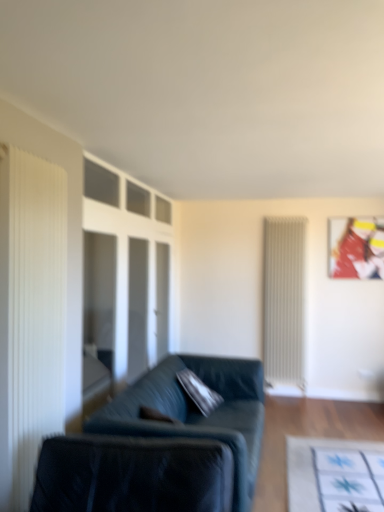
Question: From their relative heights in the image, would you say white pleated curtain at left is taller or shorter than transparent glass door at center?

Choices:
 (A) tall
 (B) short

Answer: (A)

Question: Considering the positions of point (18, 226) and point (147, 278), is point (18, 226) closer or farther from the camera than point (147, 278)?

Choices:
 (A) farther
 (B) closer

Answer: (B)

Question: Estimate the real-world distances between objects in this image. Which object is closer to the white pleated curtain at left?

Choices:
 (A) transparent glass door at center
 (B) white ribbed radiator at right
 (C) velvet dark green pillow at center
 (D) velvet black swivel chair at lower left
 (E) velvet dark green couch at center

Answer: (D)

Question: Which object is the closest to the transparent glass door at center?

Choices:
 (A) velvet dark green pillow at center
 (B) metallic glossy picture frame at upper right
 (C) white ribbed radiator at right
 (D) velvet black swivel chair at lower left
 (E) white pleated curtain at left

Answer: (A)